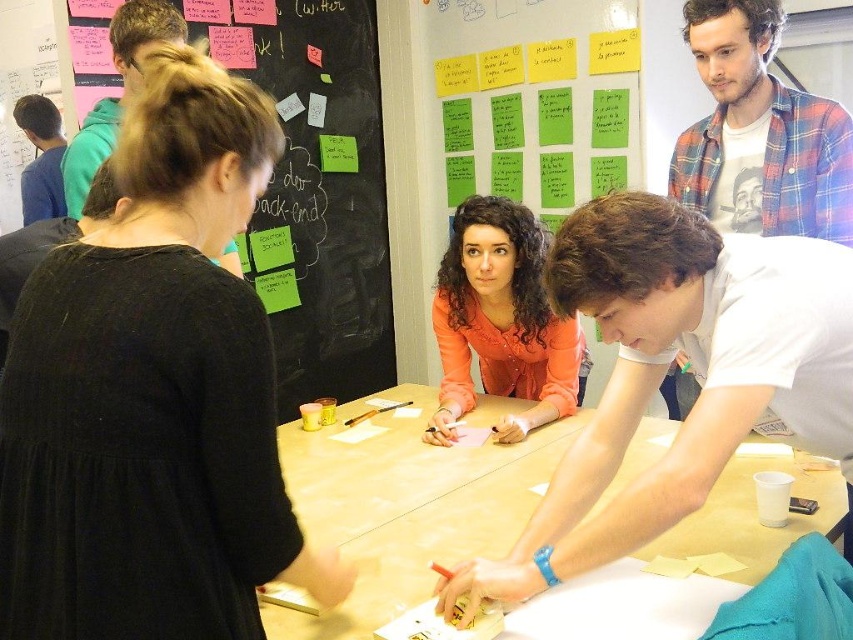
Question: Estimate the real-world distances between objects in this image. Which object is closer to the blue shirt at left?

Choices:
 (A) white matte shirt at center
 (B) light brown wood table at center
 (C) plaid flannel shirt at upper right
 (D) green paper at upper center

Answer: (D)

Question: Is white matte shirt at center closer to the viewer compared to green matte paper at upper left?

Choices:
 (A) yes
 (B) no

Answer: (A)

Question: Based on their relative distances, which object is nearer to the green matte paper at upper left?

Choices:
 (A) green paper at upper center
 (B) orange matte shirt at center

Answer: (A)

Question: Which object is positioned closest to the green paper at center?

Choices:
 (A) green matte paper at upper left
 (B) white matte shirt at center
 (C) blackboard with sticky notes at upper left
 (D) plaid flannel shirt at upper right

Answer: (A)

Question: In this image, where is blackboard with sticky notes at upper left located relative to plaid flannel shirt at upper right?

Choices:
 (A) below
 (B) above

Answer: (A)

Question: Does white matte shirt at center have a smaller size compared to blackboard with sticky notes at upper left?

Choices:
 (A) yes
 (B) no

Answer: (A)